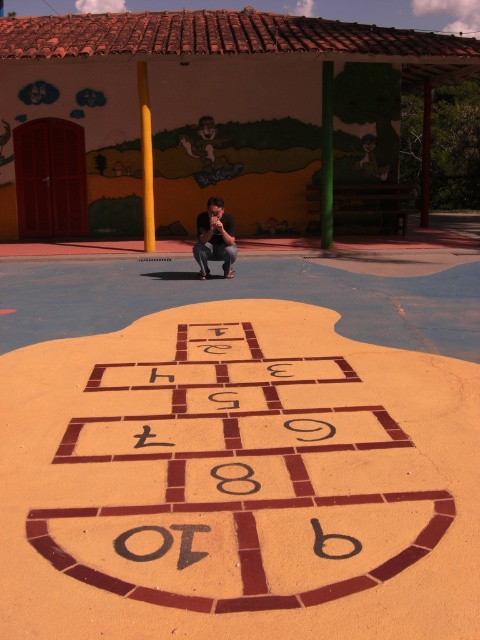
Question: Considering the relative positions of brown tile hopscotch at center and matte black shirt at center in the image provided, where is brown tile hopscotch at center located with respect to matte black shirt at center?

Choices:
 (A) left
 (B) right

Answer: (B)

Question: Does brown tile hopscotch at center come behind matte black shirt at center?

Choices:
 (A) yes
 (B) no

Answer: (B)

Question: Observing the image, what is the correct spatial positioning of brown tile hopscotch at center in reference to matte black shirt at center?

Choices:
 (A) below
 (B) above

Answer: (A)

Question: Which object appears closest to the camera in this image?

Choices:
 (A) matte black shirt at center
 (B) brown tile hopscotch at center

Answer: (B)